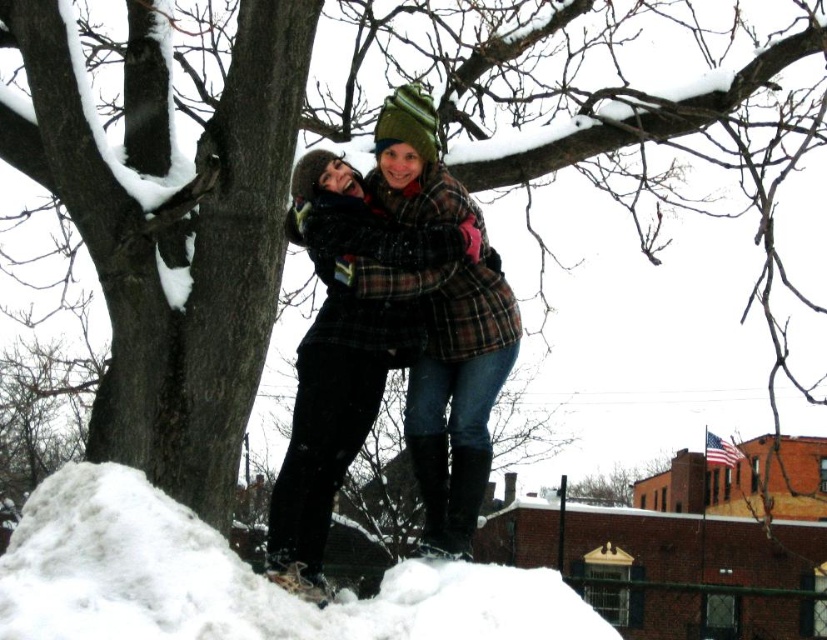
You are a delivery robot with a package that needs to be placed 1 meter away from the plaid wool coat at center. Can you place the package on the white fluffy snow at lower left?

The white fluffy snow at lower left is 1.12 meters from the plaid wool coat at center, so yes, the robot can place the package on the white fluffy snow at lower left since it is slightly farther than the required 1 meter.

You are a photographer trying to capture the scene with a camera. You want to ensure that both the white fluffy snow at lower left and the plaid wool coat at center are visible in your shot. Based on their sizes, which object should you focus on to ensure both are in frame?

The white fluffy snow at lower left is larger in width than the plaid wool coat at center. To ensure both are in frame, focus on the larger object, the white fluffy snow at lower left, as it requires more space in the composition.

You are standing at the point with coordinates point (211, 636) and want to walk towards the point with coordinates point (448, 262). Will you be moving away from or towards the snow covered tree?

Since point (211, 636) is in front of point (448, 262), moving from point (211, 636) towards point (448, 262) means you are moving away from the snow covered tree.